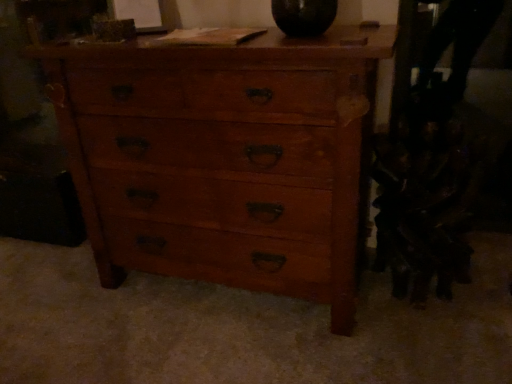
Question: Considering the relative sizes of dark brown leather swivel chair at right and wooden chest of drawers at center in the image provided, is dark brown leather swivel chair at right shorter than wooden chest of drawers at center?

Choices:
 (A) yes
 (B) no

Answer: (A)

Question: From a real-world perspective, is dark brown leather swivel chair at right below wooden chest of drawers at center?

Choices:
 (A) yes
 (B) no

Answer: (A)

Question: From the image's perspective, does dark brown leather swivel chair at right appear lower than wooden chest of drawers at center?

Choices:
 (A) yes
 (B) no

Answer: (A)

Question: Are dark brown leather swivel chair at right and wooden chest of drawers at center beside each other?

Choices:
 (A) no
 (B) yes

Answer: (A)

Question: Is dark brown leather swivel chair at right looking in the opposite direction of wooden chest of drawers at center?

Choices:
 (A) yes
 (B) no

Answer: (B)

Question: Is the depth of dark brown leather swivel chair at right greater than that of wooden chest of drawers at center?

Choices:
 (A) no
 (B) yes

Answer: (B)

Question: Is wooden chest of drawers at center at the left side of dark brown leather swivel chair at right?

Choices:
 (A) no
 (B) yes

Answer: (B)

Question: Is wooden chest of drawers at center further to camera compared to dark brown leather swivel chair at right?

Choices:
 (A) yes
 (B) no

Answer: (B)

Question: From the image's perspective, does wooden chest of drawers at center appear lower than dark brown leather swivel chair at right?

Choices:
 (A) no
 (B) yes

Answer: (A)

Question: Is wooden chest of drawers at center smaller than dark brown leather swivel chair at right?

Choices:
 (A) yes
 (B) no

Answer: (B)

Question: From a real-world perspective, is wooden chest of drawers at center under dark brown leather swivel chair at right?

Choices:
 (A) yes
 (B) no

Answer: (B)

Question: Can you confirm if wooden chest of drawers at center is wider than dark brown leather swivel chair at right?

Choices:
 (A) no
 (B) yes

Answer: (B)

Question: Considering the positions of dark brown leather swivel chair at right and wooden chest of drawers at center in the image, is dark brown leather swivel chair at right bigger or smaller than wooden chest of drawers at center?

Choices:
 (A) big
 (B) small

Answer: (B)